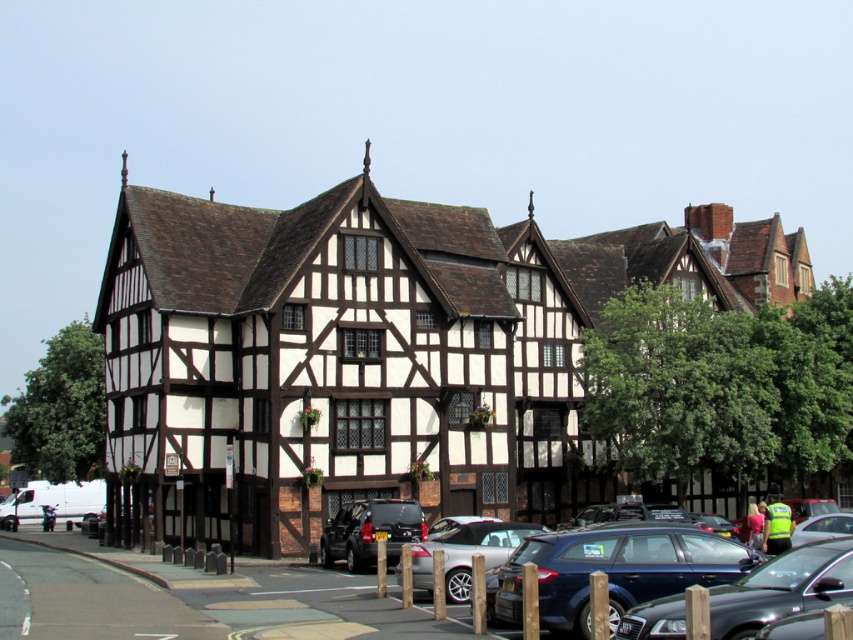
Question: Which of these objects is positioned closest to the metallic blue sedan at center?

Choices:
 (A) metallic blue hatchback at center
 (B) silver metallic car at lower center

Answer: (A)

Question: Which of the following is the closest to the observer?

Choices:
 (A) silver metallic car at lower center
 (B) metallic blue hatchback at center
 (C) metallic blue sedan at center

Answer: (C)

Question: Can you confirm if metallic blue sedan at center is positioned to the left of metallic blue hatchback at center?

Choices:
 (A) no
 (B) yes

Answer: (A)

Question: Which point appears farthest from the camera in this image?

Choices:
 (A) (483, 556)
 (B) (572, 545)

Answer: (A)

Question: Can you confirm if metallic blue hatchback at center is wider than silver metallic car at lower center?

Choices:
 (A) yes
 (B) no

Answer: (A)

Question: Is metallic blue sedan at center above silver metallic car at lower center?

Choices:
 (A) no
 (B) yes

Answer: (B)